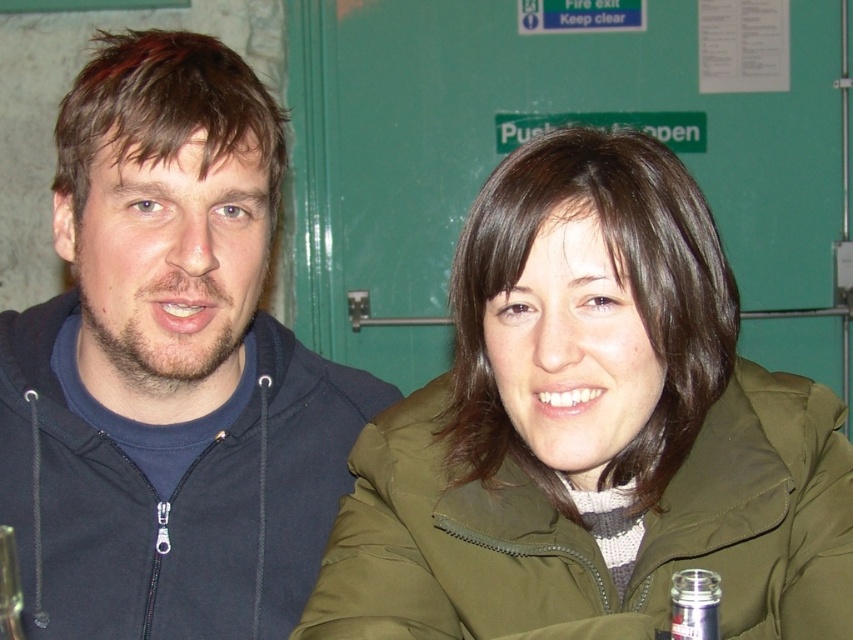
Consider the image. You are standing in front of the two people in the image. Which of the two points, point (355, 436) or point (0, 557), is closer to you?

Point (355, 436) is closer to you because it is further to the viewer than point (0, 557).

You are a photographer setting up a shot of two people sitting on a couch. You notice a clear glass bottle at center and a clear plastic bottle at lower left. Which bottle is closer to the right side of the frame?

The clear glass bottle at center is positioned on the right side of the clear plastic bottle at lower left, so it is closer to the right side of the frame.

You are a delivery person who needs to place a new 18 inch package between the clear glass bottle at center and the clear plastic bottle at lower left. Can the package fit in the space between them?

The distance between the clear glass bottle at center and the clear plastic bottle at lower left is 20.46 inches, which is greater than the 18 inch package, so the package can fit between them.